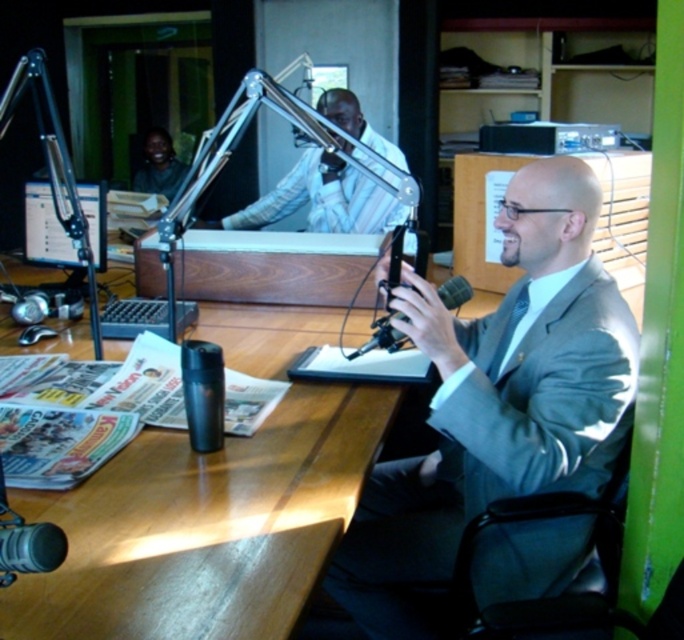
Can you confirm if white striped shirt at upper center is bigger than matte black shirt at upper left?

Yes.

Is point (241, 224) closer to viewer compared to point (148, 173)?

That is True.

Which is in front, point (321, 195) or point (155, 147)?

Point (321, 195)

Where is `white striped shirt at upper center`? This screenshot has height=640, width=684. white striped shirt at upper center is located at coordinates (324, 198).

Is wooden table at center positioned before matte black monitor at upper left?

Yes, wooden table at center is in front of matte black monitor at upper left.

Does wooden table at center have a lesser height compared to matte black monitor at upper left?

No.

Does point (276, 445) come closer to viewer compared to point (105, 252)?

That is True.

Where is `wooden table at center`? The image size is (684, 640). wooden table at center is located at coordinates (205, 525).

Between gray suit at center and white striped shirt at upper center, which one appears on the left side from the viewer's perspective?

From the viewer's perspective, white striped shirt at upper center appears more on the left side.

Does gray suit at center come in front of white striped shirt at upper center?

Yes, it is in front of white striped shirt at upper center.

Does point (510, 182) come closer to viewer compared to point (261, 218)?

Yes, it is in front of point (261, 218).

You are a GUI agent. You are given a task and a screenshot of the screen. Output one action in this format:
    pyautogui.click(x=<x>, y=<y>)
    Task: Click on the gray suit at center
    The image size is (684, 640).
    Given the screenshot: What is the action you would take?
    pyautogui.click(x=497, y=403)